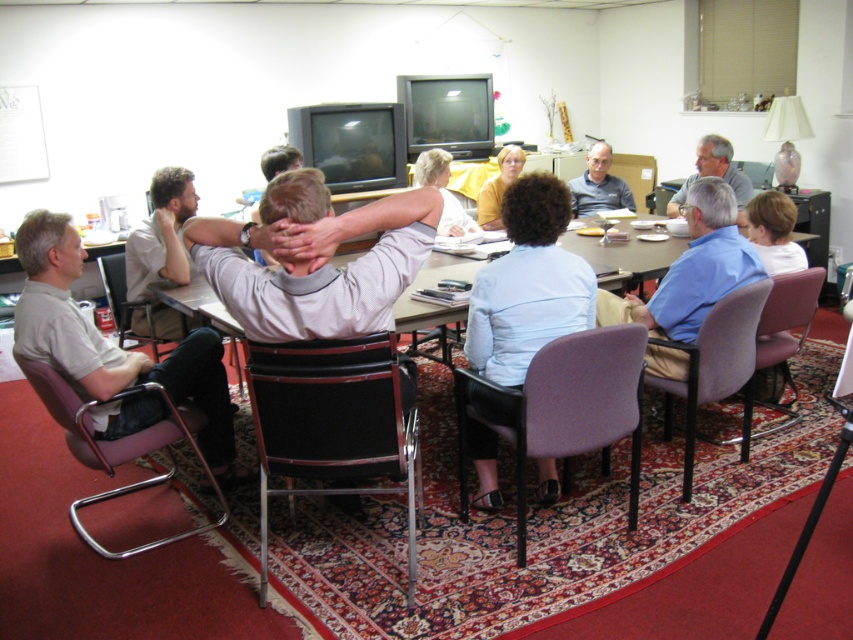
Question: Where is purple plastic chair at lower right located in relation to gray sweater at center in the image?

Choices:
 (A) below
 (B) above

Answer: (A)

Question: Which object is the closest to the gray sweater at center?

Choices:
 (A) purple fabric chair at lower right
 (B) pink fabric chair at lower left
 (C) purple plastic chair at lower right
 (D) light blue fabric shirt at center

Answer: (C)

Question: Estimate the real-world distances between objects in this image. Which object is closer to the matte gray shirt at upper right?

Choices:
 (A) gray sweater at center
 (B) metallic gray chair at left
 (C) pink fabric chair at lower left
 (D) purple fabric chair at center

Answer: (A)

Question: Is purple fabric chair at lower right further to camera compared to purple plastic chair at lower right?

Choices:
 (A) yes
 (B) no

Answer: (B)

Question: Where is black leather chair at center located in relation to pink fabric chair at lower left in the image?

Choices:
 (A) right
 (B) left

Answer: (A)

Question: Among these points, which one is nearest to the camera?

Choices:
 (A) (689, 456)
 (B) (714, 227)
 (C) (590, 161)

Answer: (A)